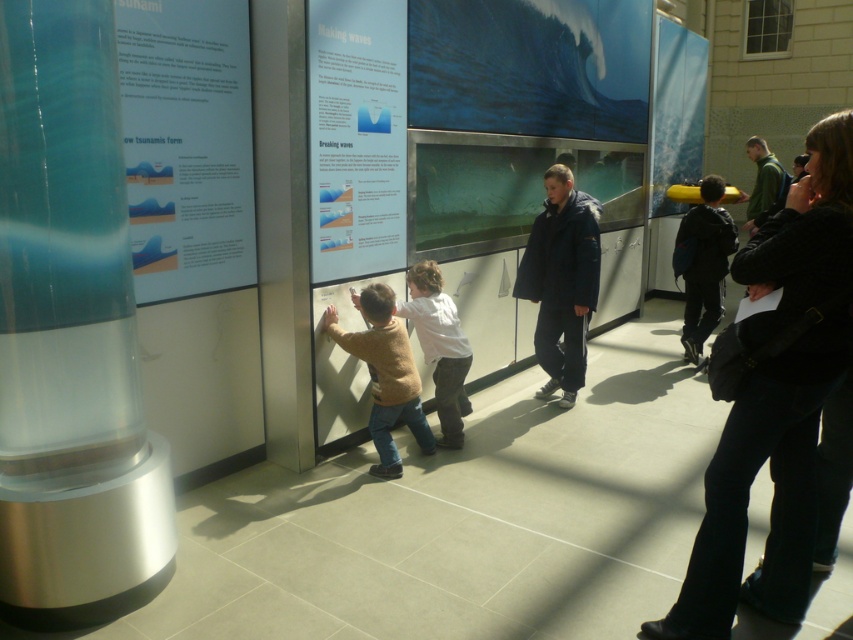
Is transparent glass cylinder at left taller than dark blue jacket at right?

Yes, transparent glass cylinder at left is taller than dark blue jacket at right.

Between transparent glass cylinder at left and dark blue jacket at right, which one appears on the left side from the viewer's perspective?

transparent glass cylinder at left

This screenshot has width=853, height=640. Describe the element at coordinates (70, 333) in the screenshot. I see `transparent glass cylinder at left` at that location.

Where is `transparent glass cylinder at left`? This screenshot has height=640, width=853. transparent glass cylinder at left is located at coordinates (70, 333).

Does white cotton shirt at center appear on the right side of green matte jacket at upper right?

No, white cotton shirt at center is not to the right of green matte jacket at upper right.

This screenshot has height=640, width=853. Identify the location of white cotton shirt at center. (439, 346).

Find the location of a particular element. white cotton shirt at center is located at coordinates coord(439,346).

Between dark blue jacket at center and white paper at center, which one has more height?

Result: With more height is dark blue jacket at center.

Who is more forward, (831, 324) or (347, 132)?

Point (831, 324) is in front.

Where is `dark blue jacket at center`? dark blue jacket at center is located at coordinates (776, 400).